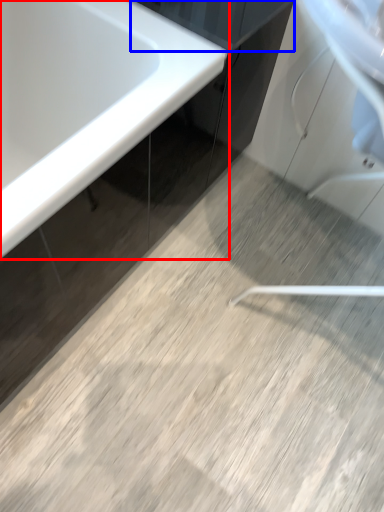
Question: Which point is further to the camera, bathtub (highlighted by a red box) or cabinetry (highlighted by a blue box)?

Choices:
 (A) bathtub
 (B) cabinetry

Answer: (B)